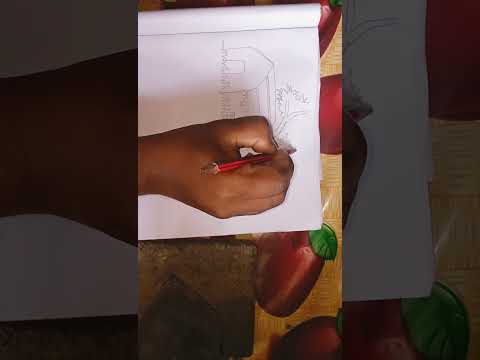
The width and height of the screenshot is (480, 360). Identify the location of pen. (220, 165).